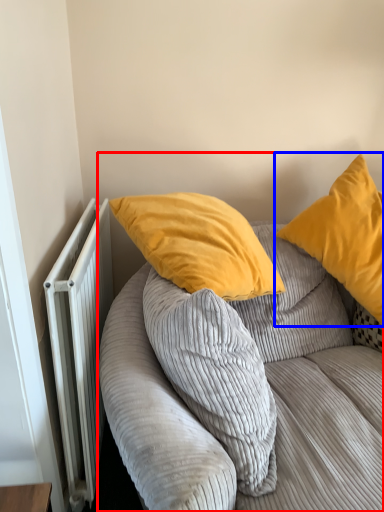
Question: Which object appears closest to the camera in this image, studio couch (highlighted by a red box) or pillow (highlighted by a blue box)?

Choices:
 (A) studio couch
 (B) pillow

Answer: (A)